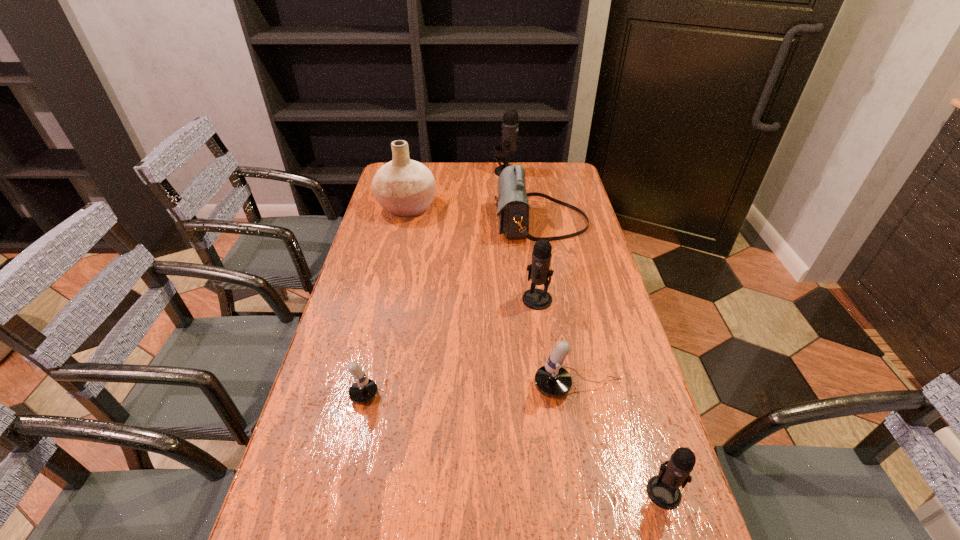
Locate an element on the screen. The height and width of the screenshot is (540, 960). the farthest microphone is located at coordinates (510, 124).

The height and width of the screenshot is (540, 960). I want to click on the biggest black microphone, so (x=510, y=124).

Image resolution: width=960 pixels, height=540 pixels. Find the location of `reddish-brown pottery`. reddish-brown pottery is located at coordinates (405, 188).

Find the location of a particular element. Image resolution: width=960 pixels, height=540 pixels. the second nearest black microphone is located at coordinates (537, 299).

Identify the location of the second smallest black microphone. This screenshot has height=540, width=960. (537, 299).

Where is `shoulder bag`? shoulder bag is located at coordinates (512, 204).

Where is `the bigger white microphone`? The image size is (960, 540). the bigger white microphone is located at coordinates (552, 380).

Where is `the nearest object`? Image resolution: width=960 pixels, height=540 pixels. the nearest object is located at coordinates (663, 489).

This screenshot has width=960, height=540. I want to click on the nearest black microphone, so click(x=663, y=489).

The height and width of the screenshot is (540, 960). In order to click on the smaller white microphone in this screenshot , I will do `click(364, 390)`.